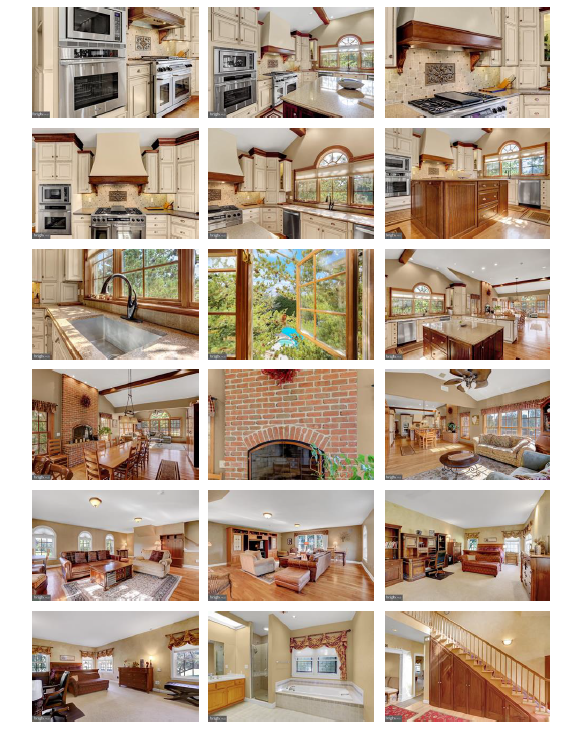
Find the location of `kitchen images`. kitchen images is located at coordinates (114, 66), (266, 56), (521, 48), (131, 198), (285, 195), (511, 186), (74, 337), (491, 316).